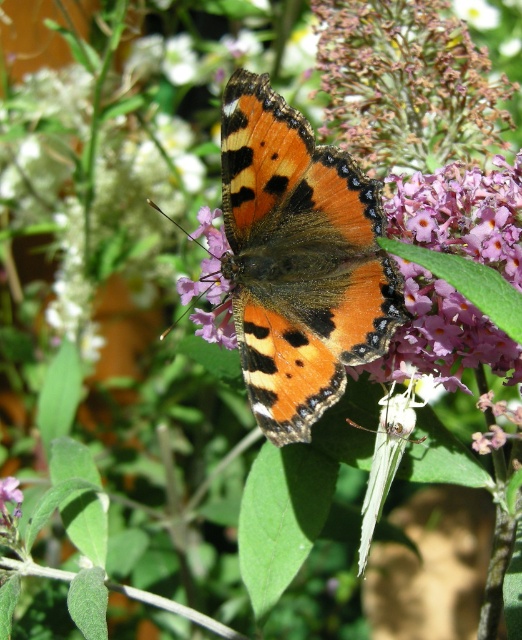
Who is positioned more to the right, orange matte butterfly at center or purple matte flower at center?

From the viewer's perspective, orange matte butterfly at center appears more on the right side.

Can you confirm if orange matte butterfly at center is wider than purple matte flower at center?

Correct, the width of orange matte butterfly at center exceeds that of purple matte flower at center.

Which is behind, point (254, 204) or point (212, 228)?

Positioned behind is point (212, 228).

The width and height of the screenshot is (522, 640). What are the coordinates of `orange matte butterfly at center` in the screenshot? It's located at (299, 260).